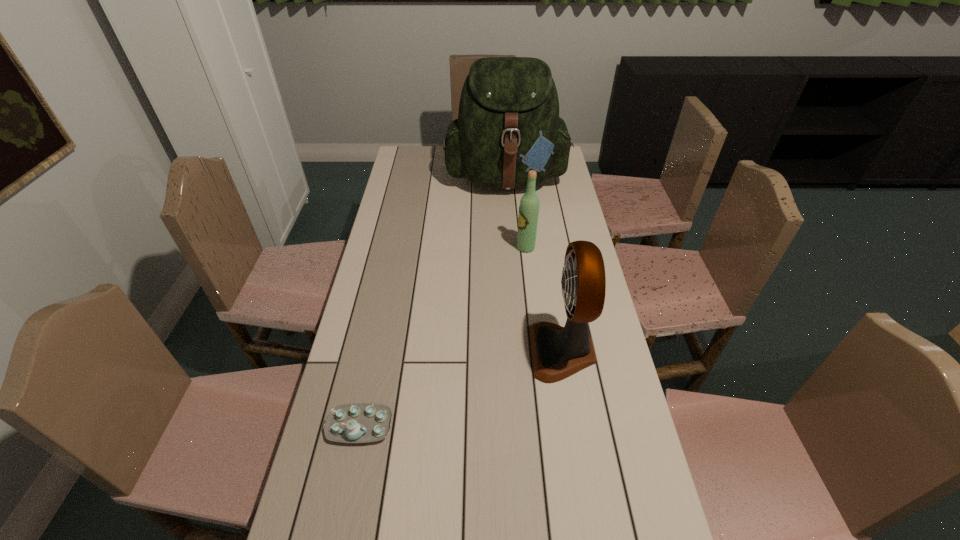
At what (x,y) coordinates should I click in order to perform the action: click on free space between the third farthest object and the tallest object. Please return your answer as a coordinate pair (x, y). Looking at the image, I should click on click(x=535, y=265).

Locate which object is the closest to the nearest object. Please provide its 2D coordinates. Your answer should be formatted as a tuple, i.e. [(x, y)], where the tuple contains the x and y coordinates of a point satisfying the conditions above.

[(557, 352)]

Identify the location of the second closest object to the second farthest object. This screenshot has width=960, height=540. (557, 352).